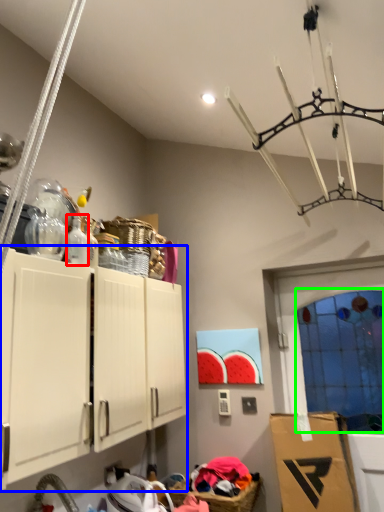
Question: Based on their relative distances, which object is farther from bottle (highlighted by a red box)? Choose from cabinetry (highlighted by a blue box) and glass door (highlighted by a green box).

Choices:
 (A) cabinetry
 (B) glass door

Answer: (B)